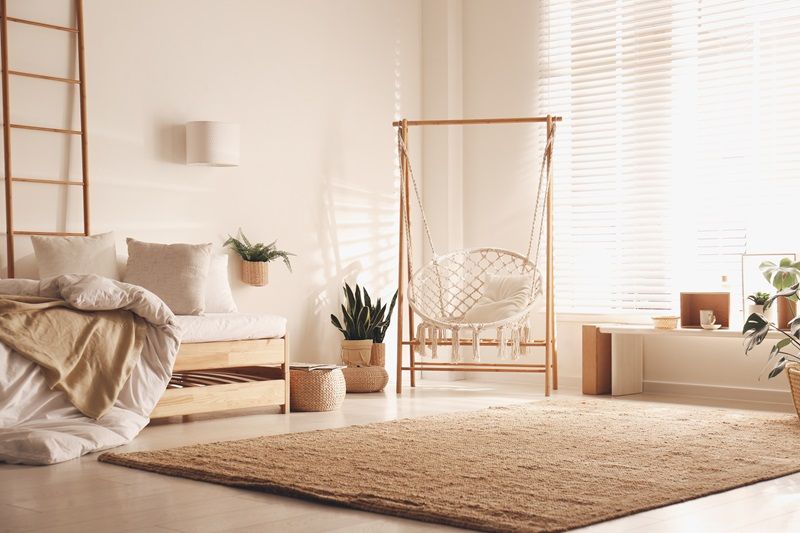
This screenshot has height=533, width=800. Identify the location of blanket. (26, 393).